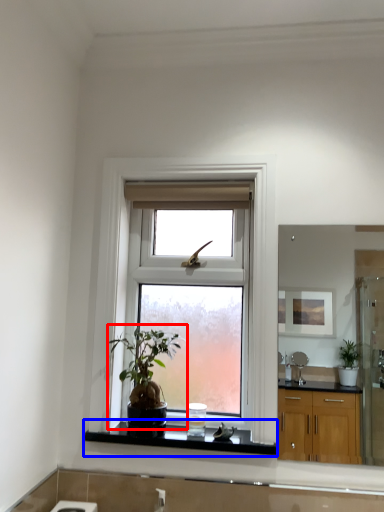
Question: Which object appears farthest to the camera in this image, houseplant (highlighted by a red box) or window sill (highlighted by a blue box)?

Choices:
 (A) houseplant
 (B) window sill

Answer: (B)